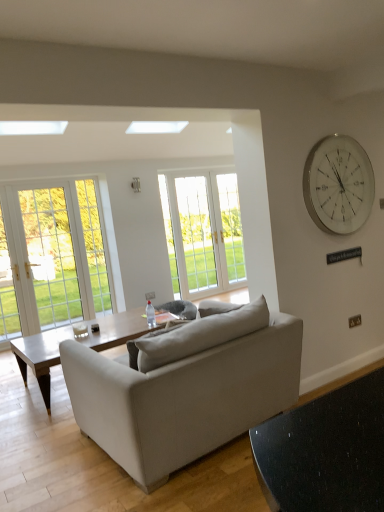
Question: Does white glass window at center have a larger size compared to white plastic power outlet at center?

Choices:
 (A) yes
 (B) no

Answer: (A)

Question: Can you confirm if white glass window at center is shorter than white plastic power outlet at center?

Choices:
 (A) no
 (B) yes

Answer: (A)

Question: Does white glass window at center have a smaller size compared to white plastic power outlet at center?

Choices:
 (A) yes
 (B) no

Answer: (B)

Question: Is white glass window at center beside white plastic power outlet at center?

Choices:
 (A) yes
 (B) no

Answer: (B)

Question: Does white glass window at center have a greater width compared to white plastic power outlet at center?

Choices:
 (A) yes
 (B) no

Answer: (A)

Question: Considering their positions, is white glass clock at upper right located in front of or behind light brown wooden coffee table at center?

Choices:
 (A) behind
 (B) front

Answer: (B)

Question: From a real-world perspective, is white glass clock at upper right positioned above or below light brown wooden coffee table at center?

Choices:
 (A) above
 (B) below

Answer: (A)

Question: From the image's perspective, is white glass clock at upper right located above or below light brown wooden coffee table at center?

Choices:
 (A) above
 (B) below

Answer: (A)

Question: Based on their sizes in the image, would you say white glass clock at upper right is bigger or smaller than light brown wooden coffee table at center?

Choices:
 (A) small
 (B) big

Answer: (A)

Question: Is clear glass bottle at center wider or thinner than white glass window at center?

Choices:
 (A) thin
 (B) wide

Answer: (B)

Question: From a real-world perspective, relative to white glass window at center, is clear glass bottle at center vertically above or below?

Choices:
 (A) below
 (B) above

Answer: (A)

Question: Is clear glass bottle at center spatially inside white glass window at center, or outside of it?

Choices:
 (A) outside
 (B) inside

Answer: (A)

Question: In terms of height, does clear glass bottle at center look taller or shorter compared to white glass window at center?

Choices:
 (A) short
 (B) tall

Answer: (A)

Question: Considering the positions of white glass clock at upper right and clear glass bottle at center in the image, is white glass clock at upper right taller or shorter than clear glass bottle at center?

Choices:
 (A) short
 (B) tall

Answer: (B)

Question: Is white glass clock at upper right wider or thinner than clear glass bottle at center?

Choices:
 (A) thin
 (B) wide

Answer: (A)